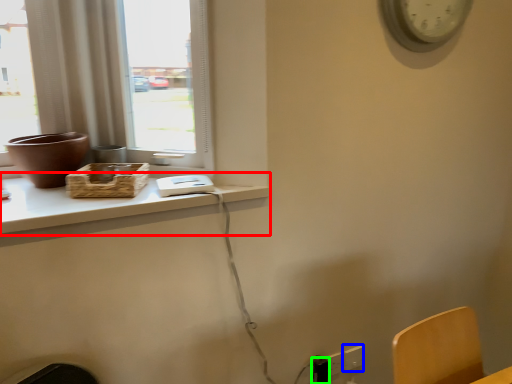
Question: Which object is the farthest from computer desk (highlighted by a red box)? Choose among these: electric outlet (highlighted by a blue box) or electric outlet (highlighted by a green box).

Choices:
 (A) electric outlet
 (B) electric outlet

Answer: (A)